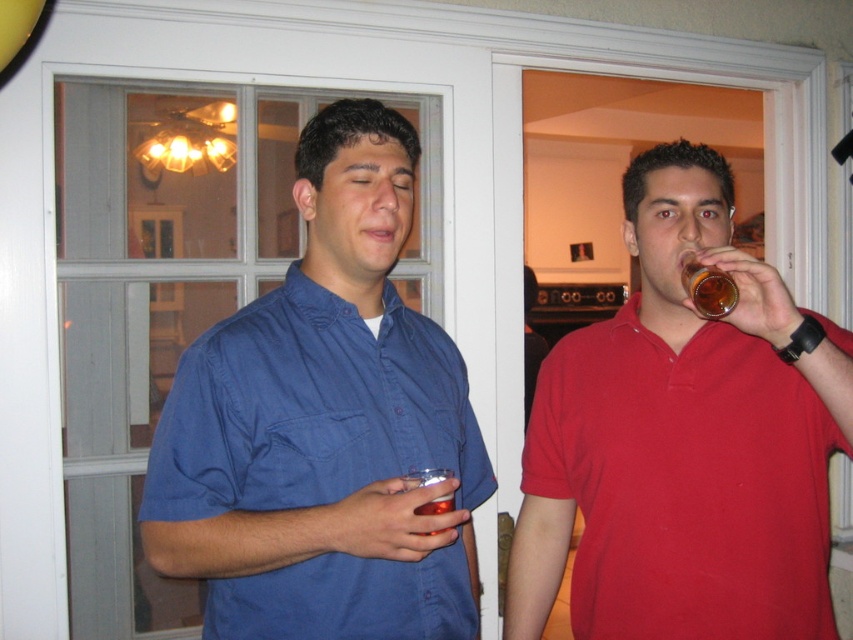
Is point (337, 131) closer to viewer compared to point (786, 416)?

Yes, it is in front of point (786, 416).

This screenshot has width=853, height=640. What do you see at coordinates (323, 426) in the screenshot?
I see `blue cotton shirt at center` at bounding box center [323, 426].

Does point (357, 484) lie in front of point (599, 365)?

Yes, it is.

Find the location of a particular element. The width and height of the screenshot is (853, 640). blue cotton shirt at center is located at coordinates (323, 426).

Measure the distance from matte red polo shirt at right to translucent amber glass at upper right.

matte red polo shirt at right is 26.12 centimeters away from translucent amber glass at upper right.

Measure the distance between matte red polo shirt at right and camera.

matte red polo shirt at right and camera are 3.63 feet apart.

Is point (709, 570) positioned after point (712, 291)?

Yes.

This screenshot has height=640, width=853. What are the coordinates of `matte red polo shirt at right` in the screenshot? It's located at (683, 440).

Which is in front, point (389, 580) or point (688, 282)?

Point (389, 580) is in front.

Does blue cotton shirt at center have a greater width compared to translucent amber glass at upper right?

Correct, the width of blue cotton shirt at center exceeds that of translucent amber glass at upper right.

Which is in front, point (256, 452) or point (722, 296)?

Point (256, 452) is more forward.

This screenshot has height=640, width=853. What are the coordinates of `blue cotton shirt at center` in the screenshot? It's located at (323, 426).